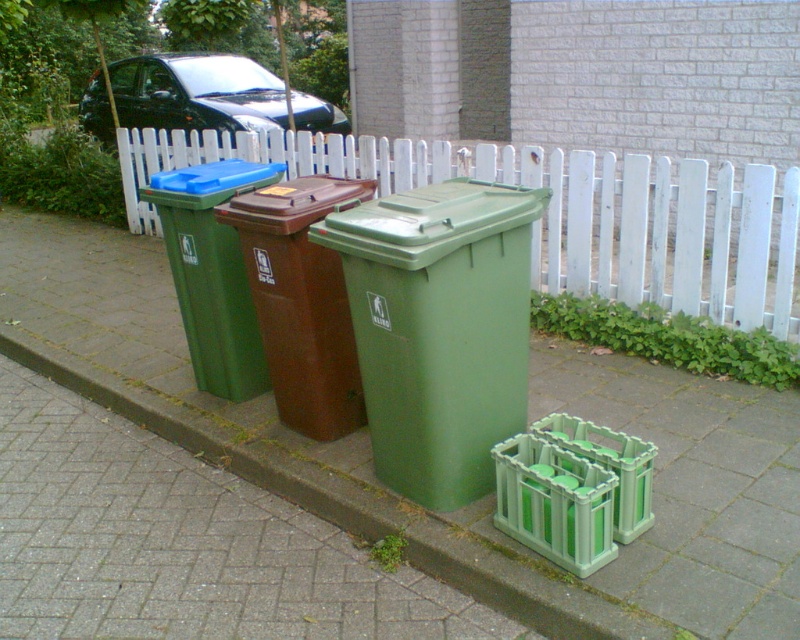
Question: Can you confirm if white picket fence at center is thinner than green matte plastic recycling bin at left?

Choices:
 (A) yes
 (B) no

Answer: (B)

Question: Estimate the real-world distances between objects in this image. Which object is farther from the green plastic pavement at center?

Choices:
 (A) brown matte recycling bin at center
 (B) green matte plastic recycling bin at left

Answer: (A)

Question: Which of the following is the farthest from the observer?

Choices:
 (A) (682, 573)
 (B) (412, 241)
 (C) (584, 230)
 (D) (281, 260)

Answer: (C)

Question: Considering the relative positions of green plastic pavement at center and green matte plastic recycling bin at center in the image provided, where is green plastic pavement at center located with respect to green matte plastic recycling bin at center?

Choices:
 (A) left
 (B) right

Answer: (A)

Question: Can you confirm if green plastic pavement at center is thinner than white picket fence at center?

Choices:
 (A) no
 (B) yes

Answer: (B)

Question: Estimate the real-world distances between objects in this image. Which object is farther from the green matte plastic recycling bin at left?

Choices:
 (A) white picket fence at center
 (B) green matte plastic recycling bin at center
 (C) green plastic pavement at center
 (D) brown matte recycling bin at center

Answer: (A)